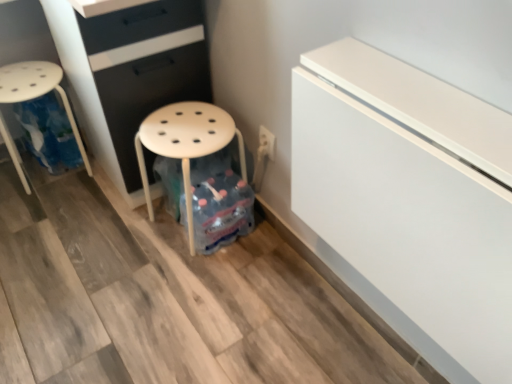
Question: Looking at their shapes, would you say white glossy fridge at upper right is wider or thinner than white matte stool at center?

Choices:
 (A) wide
 (B) thin

Answer: (B)

Question: Relative to white matte stool at center, is white glossy fridge at upper right in front or behind?

Choices:
 (A) behind
 (B) front

Answer: (B)

Question: Estimate the real-world distances between objects in this image. Which object is farther from the matte black chest of drawers at center?

Choices:
 (A) white glossy fridge at upper right
 (B) white matte stool at center
 (C) white plastic stool at left

Answer: (A)

Question: Which object is the farthest from the white glossy fridge at upper right?

Choices:
 (A) matte black chest of drawers at center
 (B) white matte stool at center
 (C) white plastic stool at left

Answer: (C)